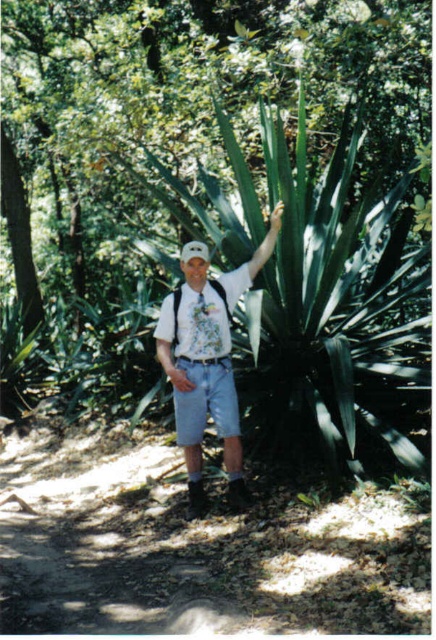
Does white cotton shirt at center have a smaller size compared to white printed t-shirt at center?

Actually, white cotton shirt at center might be larger than white printed t-shirt at center.

What do you see at coordinates (207, 356) in the screenshot? I see `white cotton shirt at center` at bounding box center [207, 356].

This screenshot has width=436, height=640. I want to click on white cotton shirt at center, so click(x=207, y=356).

Is white printed t-shirt at center wider than denim shorts at center?

Yes.

Is white printed t-shirt at center to the left of denim shorts at center from the viewer's perspective?

No, white printed t-shirt at center is not to the left of denim shorts at center.

Does point (218, 342) lie in front of point (200, 416)?

Yes.

Identify the location of white printed t-shirt at center. (196, 323).

Consider the image. Which is above, green leafy plant at center or white printed t-shirt at center?

green leafy plant at center is higher up.

From the picture: Is green leafy plant at center to the left of white printed t-shirt at center from the viewer's perspective?

Correct, you'll find green leafy plant at center to the left of white printed t-shirt at center.

This screenshot has height=640, width=436. I want to click on green leafy plant at center, so click(207, 72).